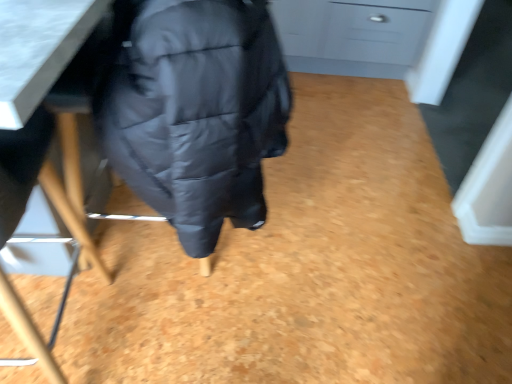
What is the approximate height of matte black jacket at under table?

It is 26.84 inches.

The height and width of the screenshot is (384, 512). What are the coordinates of `matte black chair at lower left` in the screenshot? It's located at (33, 91).

Locate an element on the screen. drawer behind the matte black jacket at under table is located at coordinates (375, 31).

From a real-world perspective, between matte black jacket at under table and matte gray drawer at upper right, who is vertically lower?

matte gray drawer at upper right.

Between matte black jacket at under table and matte gray drawer at upper right, which one has larger width?

With larger width is matte gray drawer at upper right.

Which object is thinner, matte black jacket at under table or matte black chair at lower left?

matte black chair at lower left.

Visually, is matte black jacket at under table positioned to the left or to the right of matte black chair at lower left?

matte black jacket at under table is positioned on matte black chair at lower left's right side.

From the image's perspective, is matte black jacket at under table located beneath matte black chair at lower left?

No, from the image's perspective, matte black jacket at under table is not beneath matte black chair at lower left.

Does matte black jacket at under table touch matte black chair at lower left?

No, matte black jacket at under table is not with matte black chair at lower left.

From a real-world perspective, is matte gray drawer at upper right physically located above or below matte black chair at lower left?

From a real-world perspective, matte gray drawer at upper right is physically below matte black chair at lower left.

Is matte gray drawer at upper right situated inside matte black chair at lower left or outside?

matte gray drawer at upper right is not enclosed by matte black chair at lower left.

How different are the orientations of matte gray drawer at upper right and matte black chair at lower left in degrees?

The facing directions of matte gray drawer at upper right and matte black chair at lower left are 174 degrees apart.

Where is `drawer above the matte black chair at lower left (from the image's perspective)`? The width and height of the screenshot is (512, 384). drawer above the matte black chair at lower left (from the image's perspective) is located at coordinates (375, 31).

Is point (402, 61) behind point (140, 78)?

Yes, it is.

Who is taller, matte gray drawer at upper right or matte black jacket at under table?

matte black jacket at under table is taller.

Based on the photo, from a real-world perspective, is matte gray drawer at upper right positioned over matte black jacket at under table based on gravity?

No, from a real-world perspective, matte gray drawer at upper right is not above matte black jacket at under table.

Is the surface of matte black chair at lower left in direct contact with matte black jacket at under table?

No, matte black chair at lower left is not next to matte black jacket at under table.

From a real-world perspective, is matte black chair at lower left located higher than matte black jacket at under table?

No, from a real-world perspective, matte black chair at lower left is not over matte black jacket at under table

Looking at this image, who is taller, matte black chair at lower left or matte black jacket at under table?

A: With more height is matte black chair at lower left.

In the scene shown: Does matte black chair at lower left touch matte gray drawer at upper right?

No, matte black chair at lower left is not beside matte gray drawer at upper right.

Is matte black chair at lower left aimed at matte gray drawer at upper right?

No, matte black chair at lower left is not turned towards matte gray drawer at upper right.

Does point (8, 234) appear closer or farther from the camera than point (394, 60)?

Point (8, 234).

Where is `jacket above the matte gray drawer at upper right (from a real-world perspective)`? The image size is (512, 384). jacket above the matte gray drawer at upper right (from a real-world perspective) is located at coordinates (197, 113).

Identify the location of furniture in front of the matte black jacket at under table. coord(33,91).

Considering their positions, is matte gray drawer at upper right positioned closer to matte black chair at lower left than matte black jacket at under table?

matte black jacket at under table.

When comparing their distances from matte black chair at lower left, does matte black jacket at under table or matte gray drawer at upper right seem further?

matte gray drawer at upper right is further to matte black chair at lower left.

Based on their spatial positions, is matte black jacket at under table or matte black chair at lower left closer to matte gray drawer at upper right?

The object closer to matte gray drawer at upper right is matte black jacket at under table.

In the scene shown: Considering their positions, is matte black chair at lower left positioned further to matte gray drawer at upper right than matte black jacket at under table?

matte black chair at lower left is positioned further to the anchor matte gray drawer at upper right.

Which object lies nearer to the anchor point matte black jacket at under table, matte gray drawer at upper right or matte black chair at lower left?

matte black chair at lower left.

Based on their spatial positions, is matte black chair at lower left or matte gray drawer at upper right closer to matte black jacket at under table?

matte black chair at lower left is positioned closer to the anchor matte black jacket at under table.

Identify the location of jacket between matte black chair at lower left and matte gray drawer at upper right in the front-back direction. This screenshot has width=512, height=384. (197, 113).